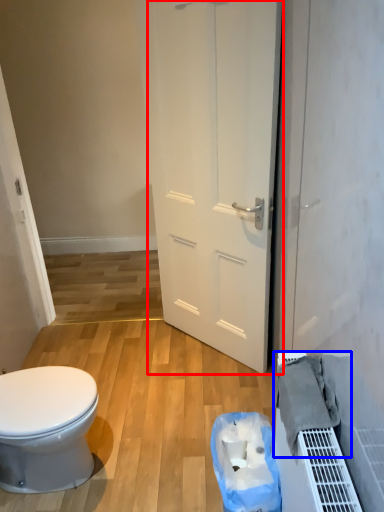
Question: Which point is further to the camera, door (highlighted by a red box) or material (highlighted by a blue box)?

Choices:
 (A) door
 (B) material

Answer: (A)